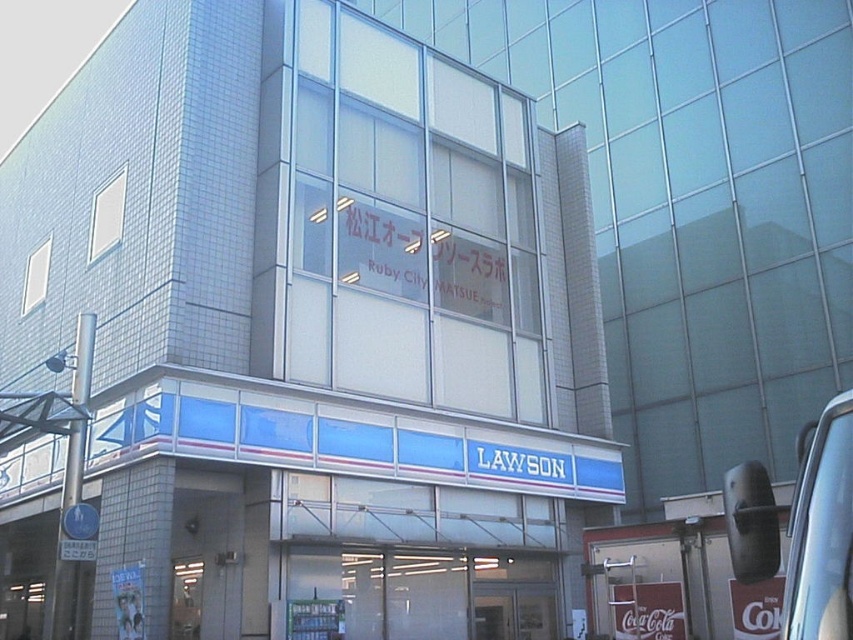
Locate an element on the screen. The image size is (853, 640). metallic gray mirror at right is located at coordinates (821, 529).

Who is lower down, metallic gray mirror at right or transparent glass door at lower center?

Positioned lower is transparent glass door at lower center.

Which is in front, point (755, 518) or point (239, 532)?

Positioned in front is point (755, 518).

Where is `metallic gray mirror at right`? metallic gray mirror at right is located at coordinates (821, 529).